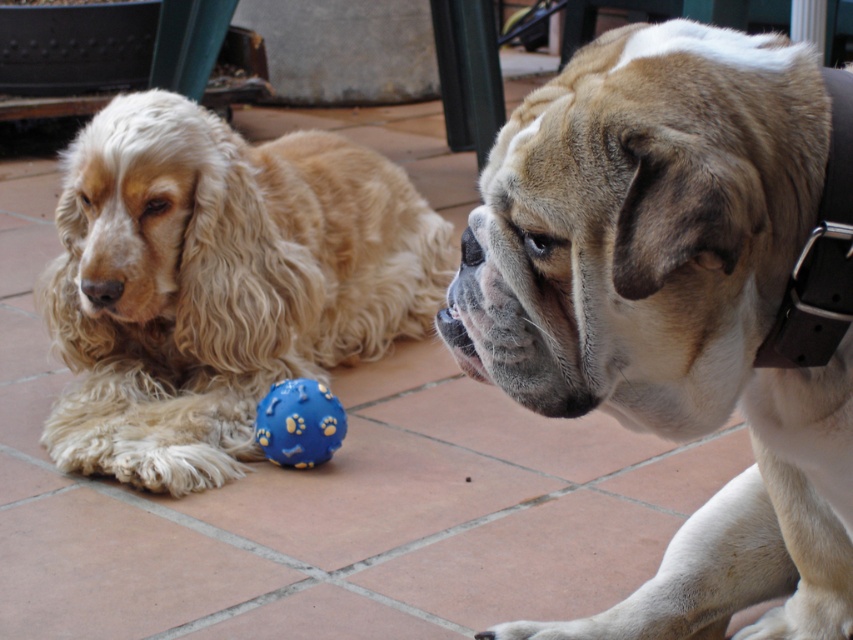
Who is lower down, brown leather collar at center or golden fur dog at left?

brown leather collar at center is lower down.

Is brown leather collar at center positioned at the back of golden fur dog at left?

No, brown leather collar at center is in front of golden fur dog at left.

Who is more distant from viewer, (694, 403) or (138, 291)?

Positioned behind is point (138, 291).

Locate an element on the screen. The height and width of the screenshot is (640, 853). brown leather collar at center is located at coordinates coord(672,307).

Between point (665, 218) and point (462, 232), which one is positioned in front?

Point (665, 218) is in front.

Does brown leather collar at center have a lesser height compared to black rubber nose at center?

No.

What do you see at coordinates (672, 307) in the screenshot? I see `brown leather collar at center` at bounding box center [672, 307].

Locate an element on the screen. The height and width of the screenshot is (640, 853). brown leather collar at center is located at coordinates (672, 307).

Can you confirm if brown leather collar at center is wider than blue rubber ball at center?

Yes, brown leather collar at center is wider than blue rubber ball at center.

Is brown leather collar at center to the right of blue rubber ball at center from the viewer's perspective?

Yes, brown leather collar at center is to the right of blue rubber ball at center.

Is point (531, 164) farther from camera compared to point (281, 381)?

That is False.

In order to click on brown leather collar at center in this screenshot , I will do `click(672, 307)`.